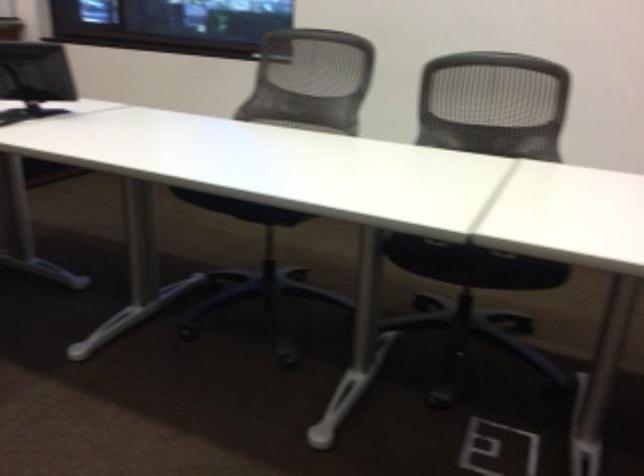
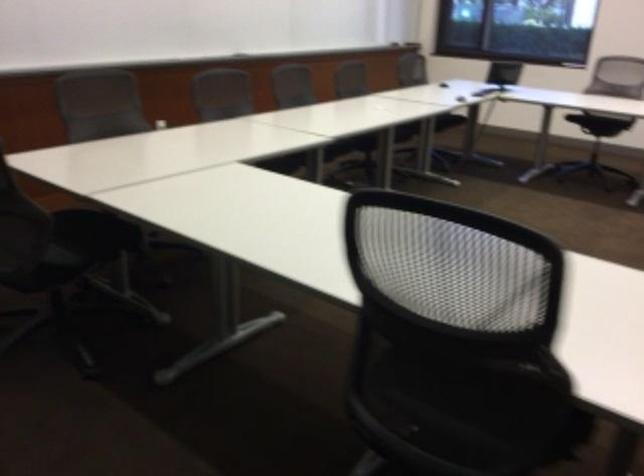
In a continuous first-person perspective shot, in which direction is the camera moving?

The movement direction of the cameraman is left, backward.